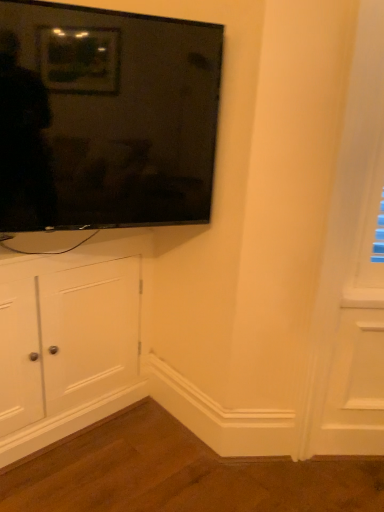
Where is `flat screen tv at upper left`? This screenshot has width=384, height=512. flat screen tv at upper left is located at coordinates (105, 117).

Describe the element at coordinates (105, 117) in the screenshot. The image size is (384, 512). I see `flat screen tv at upper left` at that location.

Identify the location of white wood cabinet at left. Image resolution: width=384 pixels, height=512 pixels. (69, 338).

This screenshot has width=384, height=512. What do you see at coordinates (69, 338) in the screenshot?
I see `white wood cabinet at left` at bounding box center [69, 338].

The width and height of the screenshot is (384, 512). I want to click on flat screen tv at upper left, so click(x=105, y=117).

Considering the relative positions of flat screen tv at upper left and white wood cabinet at left in the image provided, is flat screen tv at upper left to the left or to the right of white wood cabinet at left?

Based on their positions, flat screen tv at upper left is located to the right of white wood cabinet at left.

Which object is further away from the camera, flat screen tv at upper left or white wood cabinet at left?

white wood cabinet at left is more distant.

Is point (63, 128) less distant than point (1, 345)?

Yes, point (63, 128) is closer to viewer.

From the image's perspective, is flat screen tv at upper left under white wood cabinet at left?

No, from the image's perspective, flat screen tv at upper left is not below white wood cabinet at left.

From a real-world perspective, relative to white wood cabinet at left, is flat screen tv at upper left vertically above or below?

From a real-world perspective, flat screen tv at upper left is physically above white wood cabinet at left.

Considering the sizes of flat screen tv at upper left and white wood cabinet at left in the image, is flat screen tv at upper left wider or thinner than white wood cabinet at left?

flat screen tv at upper left is thinner than white wood cabinet at left.

Can you confirm if flat screen tv at upper left is taller than white wood cabinet at left?

No.

Considering the sizes of objects flat screen tv at upper left and white wood cabinet at left in the image provided, who is smaller, flat screen tv at upper left or white wood cabinet at left?

flat screen tv at upper left.

Can white wood cabinet at left be found inside flat screen tv at upper left?

That's incorrect, white wood cabinet at left is not inside flat screen tv at upper left.

Is there a large distance between flat screen tv at upper left and white wood cabinet at left?

That's not correct — flat screen tv at upper left is a little close to white wood cabinet at left.

Does flat screen tv at upper left turn towards white wood cabinet at left?

No, flat screen tv at upper left does not turn towards white wood cabinet at left.

Locate an element on the screen. The height and width of the screenshot is (512, 384). television above the white wood cabinet at left (from the image's perspective) is located at coordinates (105, 117).

Visually, is white wood cabinet at left positioned to the left or to the right of flat screen tv at upper left?

white wood cabinet at left is to the left of flat screen tv at upper left.

In the image, is white wood cabinet at left positioned in front of or behind flat screen tv at upper left?

white wood cabinet at left is behind flat screen tv at upper left.

Does point (90, 308) come farther from viewer compared to point (63, 151)?

Yes, point (90, 308) is farther from viewer.

From the image's perspective, is white wood cabinet at left beneath flat screen tv at upper left?

Yes, from the image's perspective, white wood cabinet at left is below flat screen tv at upper left.

From a real-world perspective, is white wood cabinet at left positioned above or below flat screen tv at upper left?

white wood cabinet at left is below flat screen tv at upper left.

Looking at this image, between white wood cabinet at left and flat screen tv at upper left, which one has smaller width?

With smaller width is flat screen tv at upper left.

Considering the sizes of white wood cabinet at left and flat screen tv at upper left in the image, is white wood cabinet at left taller or shorter than flat screen tv at upper left?

In the image, white wood cabinet at left appears to be taller than flat screen tv at upper left.

Does white wood cabinet at left have a smaller size compared to flat screen tv at upper left?

Incorrect, white wood cabinet at left is not smaller in size than flat screen tv at upper left.

Is flat screen tv at upper left a part of white wood cabinet at left?

No, flat screen tv at upper left is located outside of white wood cabinet at left.

Would you say white wood cabinet at left is a long distance from flat screen tv at upper left?

white wood cabinet at left is actually quite close to flat screen tv at upper left.

Could you tell me if white wood cabinet at left is facing flat screen tv at upper left?

No, white wood cabinet at left is not facing towards flat screen tv at upper left.

Image resolution: width=384 pixels, height=512 pixels. What are the coordinates of `cabinetry below the flat screen tv at upper left (from the image's perspective)` in the screenshot? It's located at (69, 338).

The image size is (384, 512). What are the coordinates of `television above the white wood cabinet at left (from a real-world perspective)` in the screenshot? It's located at [x=105, y=117].

Find the location of a particular element. cabinetry below the flat screen tv at upper left (from a real-world perspective) is located at coordinates (69, 338).